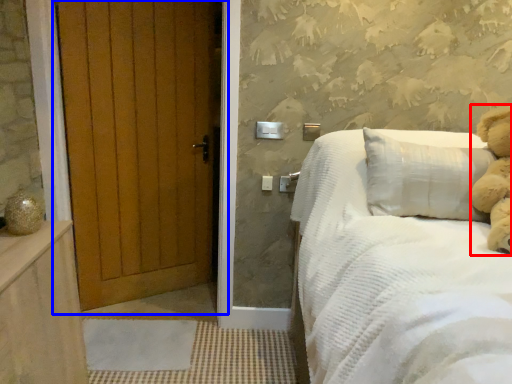
Question: Which object is closer to the camera taking this photo, teddy (highlighted by a red box) or door (highlighted by a blue box)?

Choices:
 (A) teddy
 (B) door

Answer: (A)